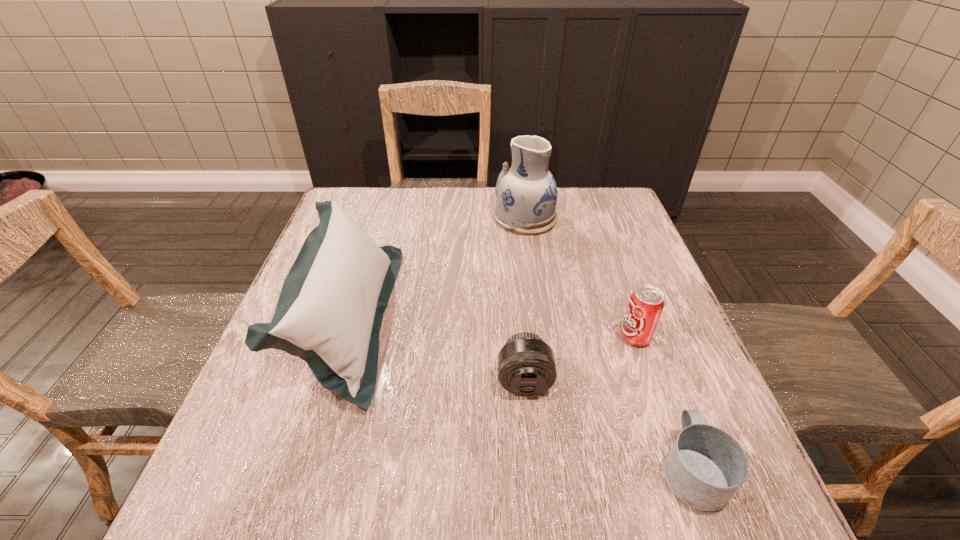
This screenshot has width=960, height=540. What are the coordinates of `the farthest object` in the screenshot? It's located at (526, 193).

What are the coordinates of `the tallest object` in the screenshot? It's located at (526, 193).

The width and height of the screenshot is (960, 540). In order to click on the second tallest object in this screenshot , I will do `click(330, 310)`.

Locate an element on the screen. This screenshot has height=540, width=960. the leftmost object is located at coordinates (330, 310).

Identify the location of the third tallest object. (646, 304).

At what (x,y) coordinates should I click in order to perform the action: click on telephoto lens. Please return your answer as a coordinate pair (x, y). This screenshot has width=960, height=540. Looking at the image, I should click on (526, 365).

Find the location of a particular element. the shortest object is located at coordinates (705, 467).

Locate an element on the screen. mug is located at coordinates (705, 467).

This screenshot has width=960, height=540. I want to click on free space located on the front of the pottery, so click(x=542, y=343).

At what (x,y) coordinates should I click in order to perform the action: click on vacant space positioned on the surface of the second tallest object. Please return your answer as a coordinate pair (x, y). Looking at the image, I should click on (436, 319).